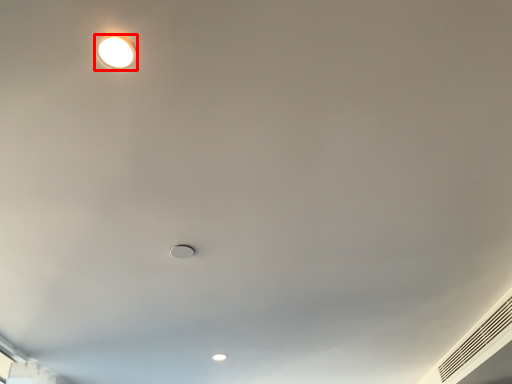
Question: From the image's perspective, considering the relative positions of lamp (annotated by the red box) and air conditioning in the image provided, where is lamp (annotated by the red box) located with respect to the staircase?

Choices:
 (A) above
 (B) below

Answer: (A)